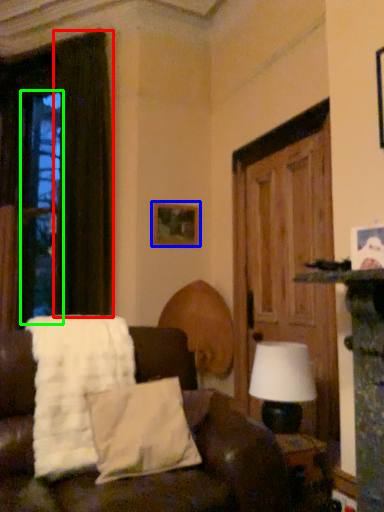
Question: Considering the real-world distances, which object is farthest from curtain (highlighted by a red box)? picture frame (highlighted by a blue box) or window (highlighted by a green box)?

Choices:
 (A) picture frame
 (B) window

Answer: (B)